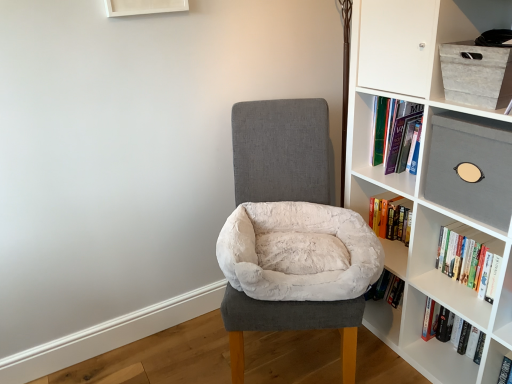
Where is `free space to the left of white plush pet bed at center`? This screenshot has height=384, width=512. free space to the left of white plush pet bed at center is located at coordinates (183, 352).